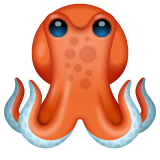
Image resolution: width=160 pixels, height=160 pixels. Identify the location of mantle. (84, 12).